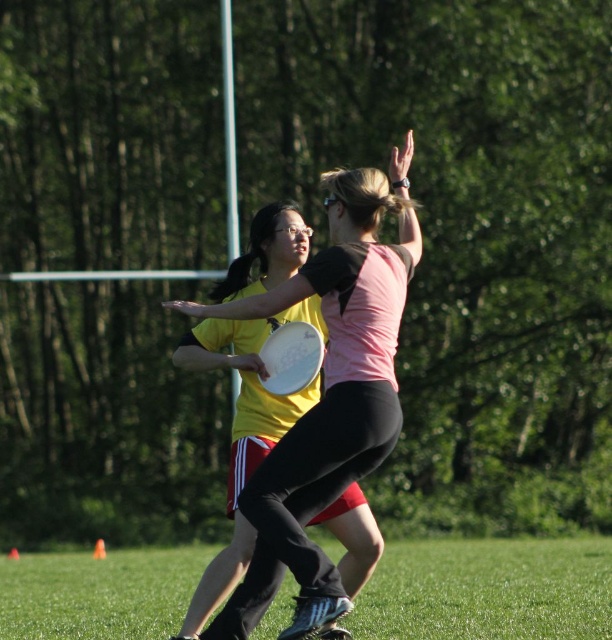
Can you confirm if green grass at lower center is positioned above matte white frisbee at center?

Actually, green grass at lower center is below matte white frisbee at center.

Which of these two, green grass at lower center or matte white frisbee at center, stands shorter?

Standing shorter between the two is green grass at lower center.

Who is more forward, [401,572] or [223,355]?

Positioned in front is point [223,355].

I want to click on green grass at lower center, so click(488, 589).

How much distance is there between green grass at lower center and white matte frisbee at center?

They are 12.01 feet apart.

Measure the distance between point (170, 548) and camera.

Point (170, 548) and camera are 21.42 meters apart.

What are the coordinates of `green grass at lower center` in the screenshot? It's located at (488, 589).

Between matte white frisbee at center and white matte frisbee at center, which one has more height?

Standing taller between the two is matte white frisbee at center.

What do you see at coordinates (241, 435) in the screenshot? I see `matte white frisbee at center` at bounding box center [241, 435].

Describe the element at coordinates (241, 435) in the screenshot. I see `matte white frisbee at center` at that location.

Locate an element on the screen. matte white frisbee at center is located at coordinates (241, 435).